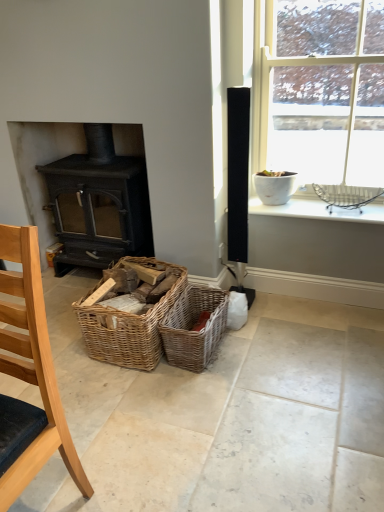
Question: From the image's perspective, is woven wood baskets at center, which ranks as the 1th picnic basket in left-to-right order, beneath woven brown picnic basket at center, the first picnic basket from the right?

Choices:
 (A) no
 (B) yes

Answer: (A)

Question: Can you confirm if woven wood baskets at center, which ranks as the 1th picnic basket in left-to-right order, is positioned to the right of woven brown picnic basket at center, the first picnic basket from the right?

Choices:
 (A) no
 (B) yes

Answer: (A)

Question: Can you confirm if woven wood baskets at center, marked as the 2th picnic basket in a right-to-left arrangement, is smaller than woven brown picnic basket at center, the first picnic basket from the right?

Choices:
 (A) yes
 (B) no

Answer: (B)

Question: Is woven wood baskets at center, which ranks as the 1th picnic basket in left-to-right order, thinner than woven brown picnic basket at center, the first picnic basket from the right?

Choices:
 (A) yes
 (B) no

Answer: (B)

Question: Is woven wood baskets at center, marked as the 2th picnic basket in a right-to-left arrangement, facing away from woven brown picnic basket at center, positioned as the second picnic basket in left-to-right order?

Choices:
 (A) yes
 (B) no

Answer: (B)

Question: Is point (92, 257) closer or farther from the camera than point (64, 443)?

Choices:
 (A) closer
 (B) farther

Answer: (B)

Question: In the image, is matte black wood burning stove at left on the left side or the right side of light wood chair at lower left?

Choices:
 (A) left
 (B) right

Answer: (A)

Question: Is matte black wood burning stove at left in front of or behind light wood chair at lower left in the image?

Choices:
 (A) behind
 (B) front

Answer: (A)

Question: In terms of width, does matte black wood burning stove at left look wider or thinner when compared to light wood chair at lower left?

Choices:
 (A) thin
 (B) wide

Answer: (B)

Question: From the image's perspective, is white glossy pot at upper right above or below matte black wood burning stove at left?

Choices:
 (A) below
 (B) above

Answer: (B)

Question: From a real-world perspective, relative to matte black wood burning stove at left, is white glossy pot at upper right vertically above or below?

Choices:
 (A) above
 (B) below

Answer: (A)

Question: Considering the positions of white glossy pot at upper right and matte black wood burning stove at left in the image, is white glossy pot at upper right taller or shorter than matte black wood burning stove at left?

Choices:
 (A) tall
 (B) short

Answer: (A)

Question: In the image, is white glossy pot at upper right on the left side or the right side of matte black wood burning stove at left?

Choices:
 (A) left
 (B) right

Answer: (B)

Question: From a real-world perspective, is white ceramic bowl at upper right physically located above or below light wood chair at lower left?

Choices:
 (A) below
 (B) above

Answer: (B)

Question: In terms of height, does white ceramic bowl at upper right look taller or shorter compared to light wood chair at lower left?

Choices:
 (A) tall
 (B) short

Answer: (B)